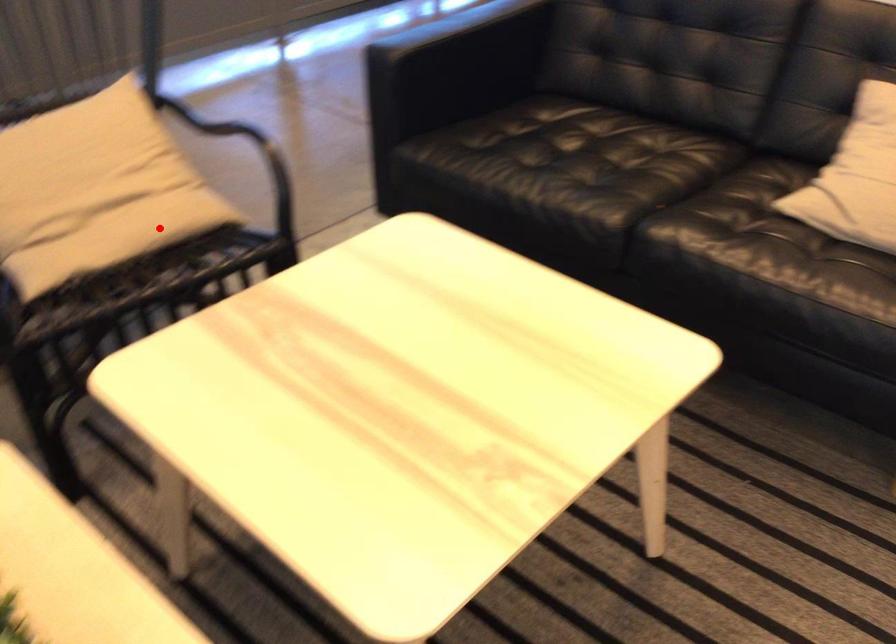
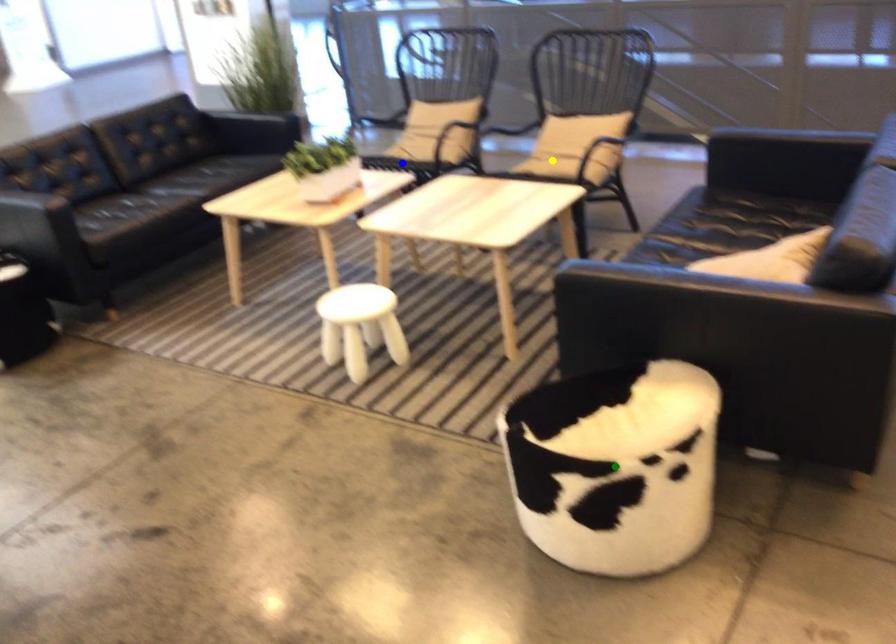
Question: I am providing you with two images of the same scene from different viewpoints. A red point is marked on the first image. You are given multiple points on the second image. Which point in image 2 is actually the same real-world point as the red point in image 1?

Choices:
 (A) yellow point
 (B) green point
 (C) blue point

Answer: (A)